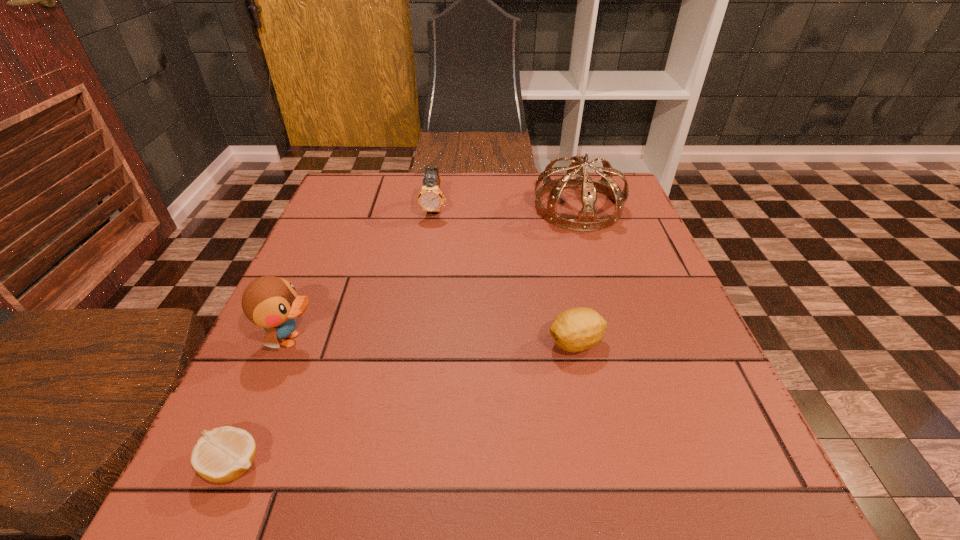
You are a GUI agent. You are given a task and a screenshot of the screen. Output one action in this format:
    pyautogui.click(x=<x>, y=<y>)
    Task: Click on the free space located 0.380m on the face of the watch
    Image resolution: width=960 pixels, height=540 pixels.
    Given the screenshot: What is the action you would take?
    pyautogui.click(x=417, y=336)

Where is `vacant area located 0.370m at the stem end of the farther lemon`? The image size is (960, 540). vacant area located 0.370m at the stem end of the farther lemon is located at coordinates (342, 343).

At what (x,y) coordinates should I click in order to perform the action: click on free region located 0.390m at the stem end of the farther lemon. Please return your answer as a coordinate pair (x, y). This screenshot has height=540, width=960. Looking at the image, I should click on (331, 343).

Find the location of a particular element. Image resolution: width=960 pixels, height=540 pixels. free location located 0.120m at the stem end of the farther lemon is located at coordinates (480, 343).

Find the location of a particular element. vacant space located 0.220m on the right of the nearest object is located at coordinates (420, 465).

Locate an element on the screen. The width and height of the screenshot is (960, 540). tiara positioned at the far edge is located at coordinates click(x=586, y=221).

The image size is (960, 540). Identify the location of watch that is positioned at the far edge. 430,198.

Where is `object present at the near edge`? This screenshot has width=960, height=540. object present at the near edge is located at coordinates (222, 455).

You are a GUI agent. You are given a task and a screenshot of the screen. Output one action in this format:
    pyautogui.click(x=<x>, y=<y>)
    Task: Click on the duck situated at the left edge
    
    Given the screenshot: What is the action you would take?
    pyautogui.click(x=270, y=302)

Where is `lemon located in the left edge section of the desktop`? The height and width of the screenshot is (540, 960). lemon located in the left edge section of the desktop is located at coordinates (222, 455).